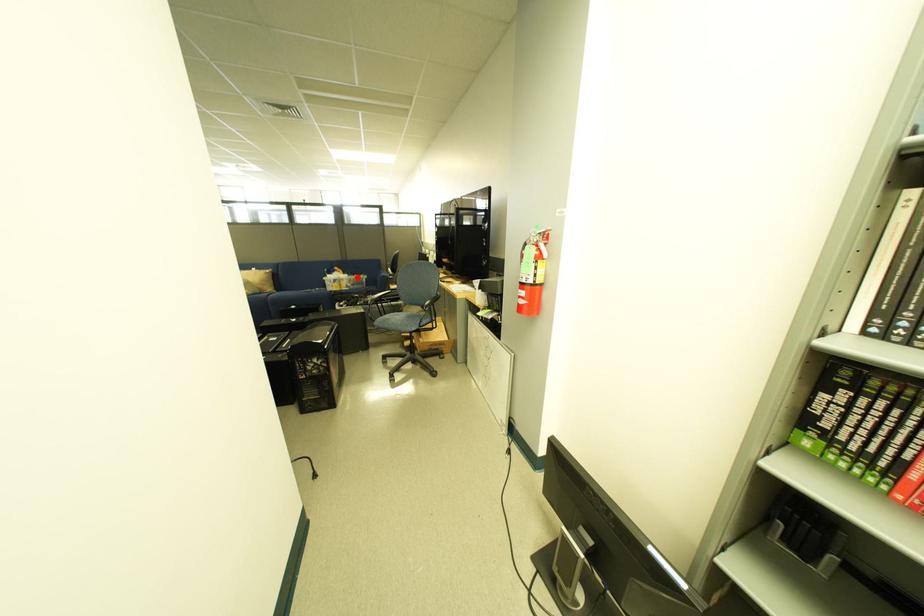
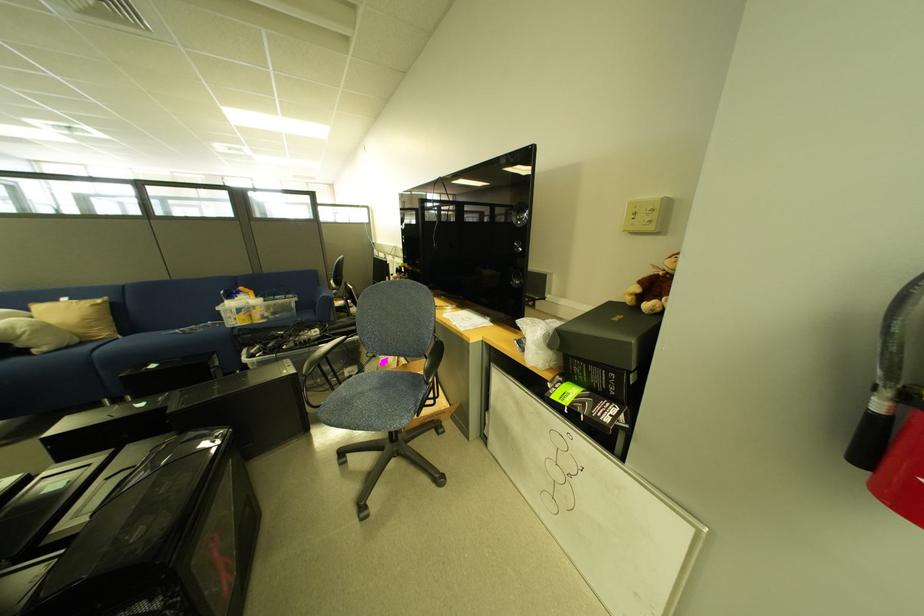
Where in the second image is the point corresponding to the highlighted location from the first image?

(272, 302)